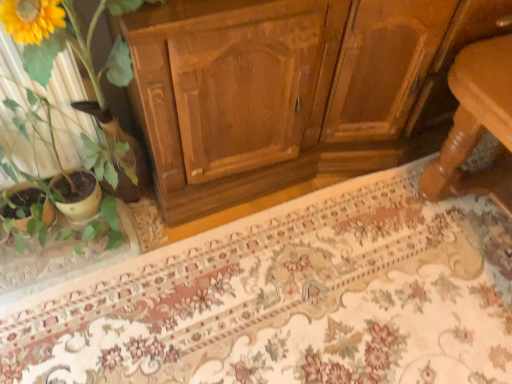
The height and width of the screenshot is (384, 512). I want to click on vacant area located to the right-hand side of matte yellow pot at left, so click(162, 269).